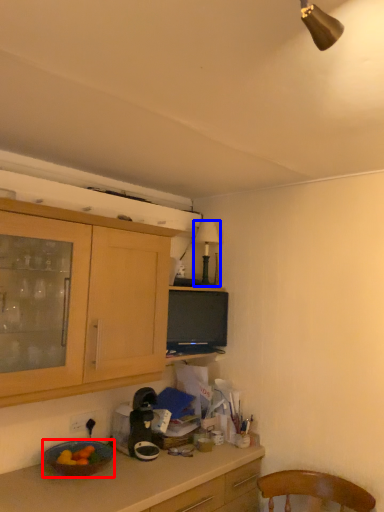
Question: Which point is closer to the camera, bowl (highlighted by a red box) or lamp (highlighted by a blue box)?

Choices:
 (A) bowl
 (B) lamp

Answer: (A)